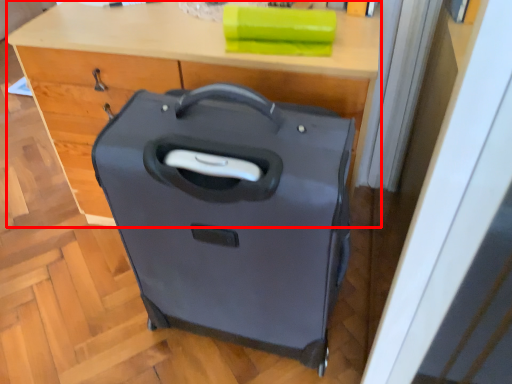
Question: Observing the image, what is the correct spatial positioning of computer desk (annotated by the red box) in reference to suitcase?

Choices:
 (A) right
 (B) left

Answer: (B)